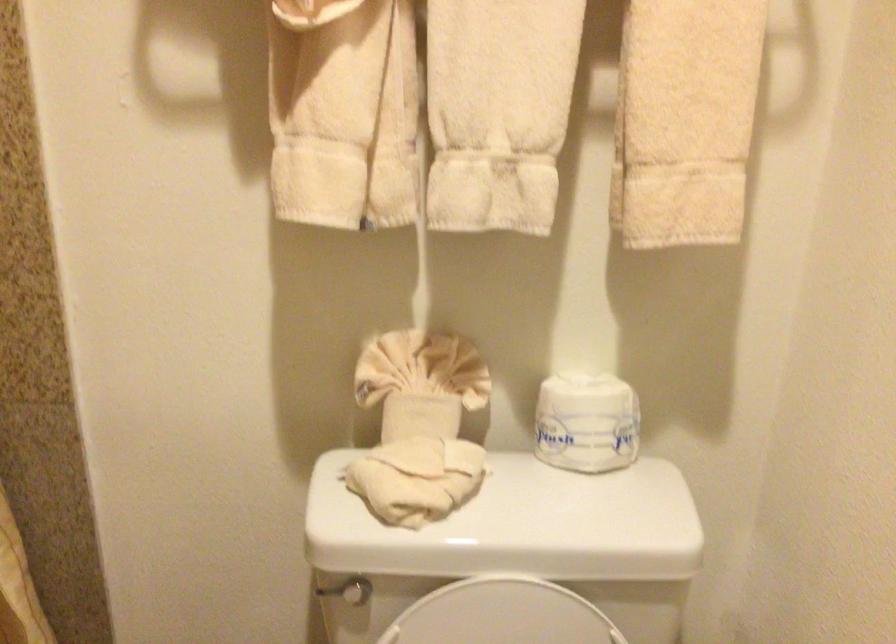
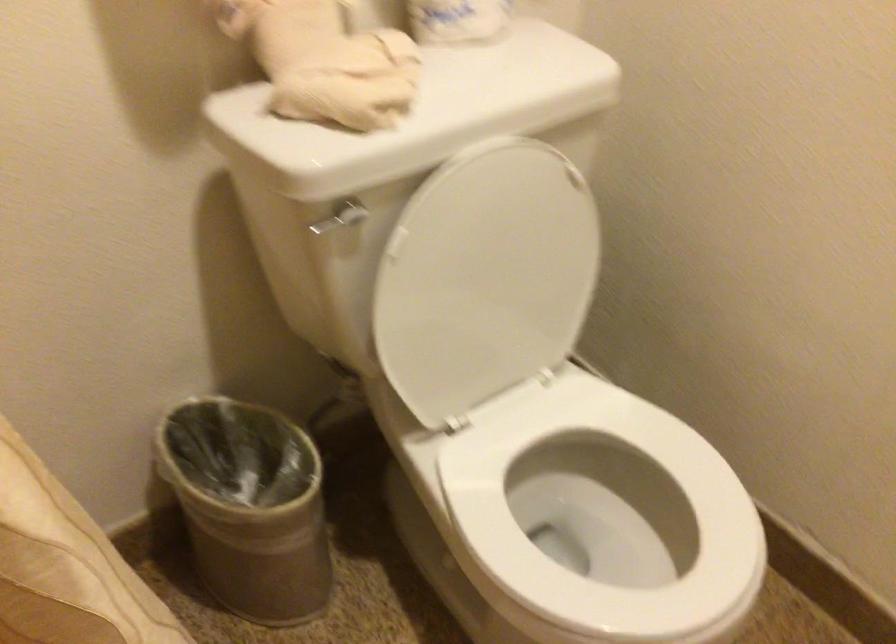
How did the camera likely rotate?

The camera's rotation is toward right-down.